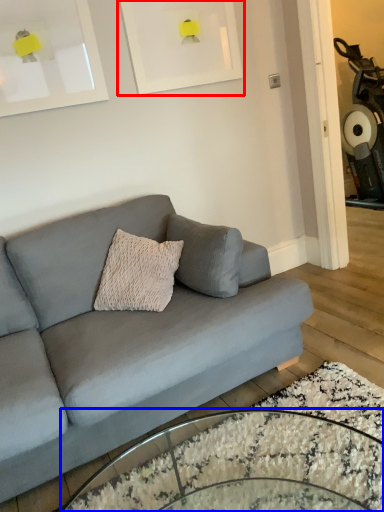
Question: Among these objects, which one is farthest to the camera, picture frame (highlighted by a red box) or coffee table (highlighted by a blue box)?

Choices:
 (A) picture frame
 (B) coffee table

Answer: (A)